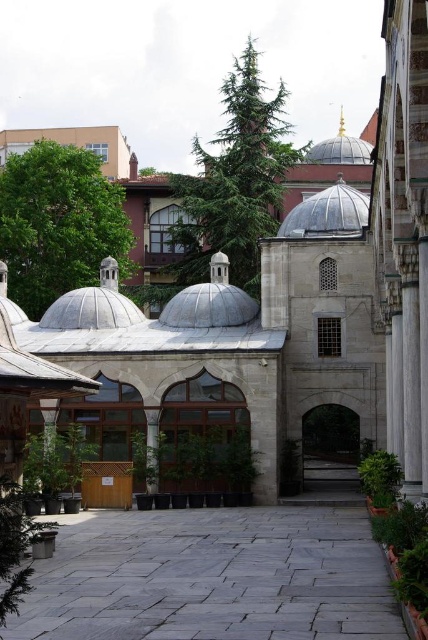
Between point (372, 570) and point (344, 212), which one is positioned behind?

The point (344, 212) is behind.

Identify the location of gray stone courtyard at center. (211, 577).

Based on the photo, which is more to the right, gray stone courtyard at center or gold domed roof at center?

From the viewer's perspective, gold domed roof at center appears more on the right side.

Which is in front, point (287, 628) or point (360, 140)?

Point (287, 628) is in front.

This screenshot has width=428, height=640. In order to click on gray stone courtyard at center in this screenshot , I will do `click(211, 577)`.

Does metallic silver dome at center appear on the right side of gold domed roof at center?

In fact, metallic silver dome at center is to the left of gold domed roof at center.

Does metallic silver dome at center have a lesser height compared to gold domed roof at center?

Correct, metallic silver dome at center is not as tall as gold domed roof at center.

Measure the distance between metallic silver dome at center and camera.

metallic silver dome at center is 82.66 meters away from camera.

Where is `metallic silver dome at center`? The width and height of the screenshot is (428, 640). metallic silver dome at center is located at coordinates (327, 212).